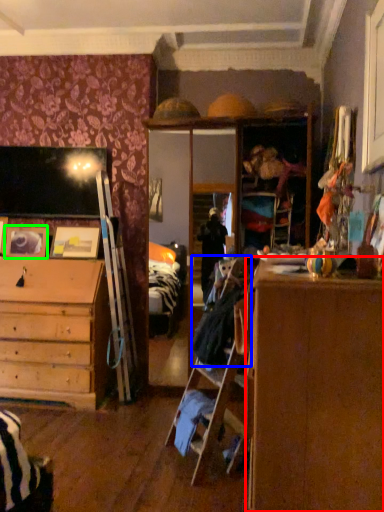
Question: Which object is positioned closest to cabinetry (highlighted by a red box)? Select from laundry (highlighted by a blue box) and picture frame (highlighted by a green box).

Choices:
 (A) laundry
 (B) picture frame

Answer: (A)